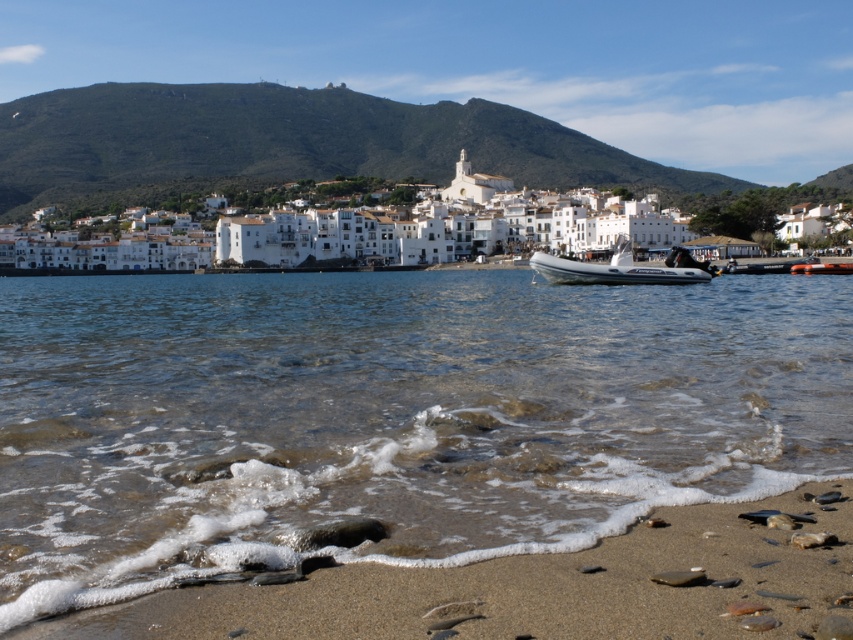
You are standing on the sandy beach and want to take a photo of both the clear water at beach center and the white matte buildings at center. Which object will appear closer to the camera in the photo?

The clear water at beach center will appear closer to the camera in the photo because it is shorter than the white matte buildings at center, making it positioned in the foreground.

You are a photographer planning to capture the coastal scene. You want to ensure that the sandy brown at lower center and the white matte buildings at center are both visible in your shot. Based on their widths, which object should you position closer to the edge of the frame to include both?

The sandy brown at lower center has a lesser width compared to the white matte buildings at center. To include both in the frame, position the sandy brown at lower center closer to the edge since it takes up less space.

You are standing on the sandy brown at lower center and want to see the white rubber boat at center. Which direction should you look to see the boat?

The white rubber boat at center is taller than the sandy brown at lower center, so you should look upward to see the white rubber boat at center.